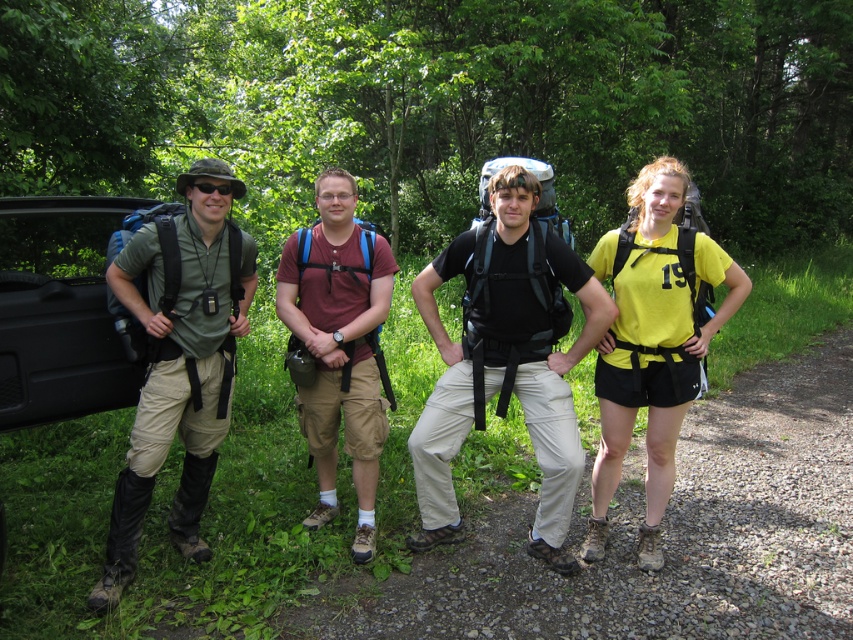
You are a hiker who needs to check the distance between your matte black backpack at center and the matte red shirt at center. Can you fit a 12 inch water bottle between them?

The distance between the matte black backpack at center and the matte red shirt at center is 21.57 inches, so yes, a 12 inch water bottle can fit between them.

You are a photographer trying to capture a group photo of the four hikers. You want to ensure that the green matte shirt at left is positioned exactly at the center of the frame. Given that the frame has a coordinate system where the bottom left corner is the origin point, what adjustment should you make to the camera position?

The green matte shirt at left is currently at point (180, 364). To center it at the frame center coordinates of (426, 320), you should move the camera slightly upward and to the right.

You are a photographer trying to capture a photo of the matte red shirt at center without the matte black backpack at center blocking it. What should you do?

Move the matte black backpack at center behind the matte red shirt at center so that it is no longer blocking the view of the matte red shirt at center.